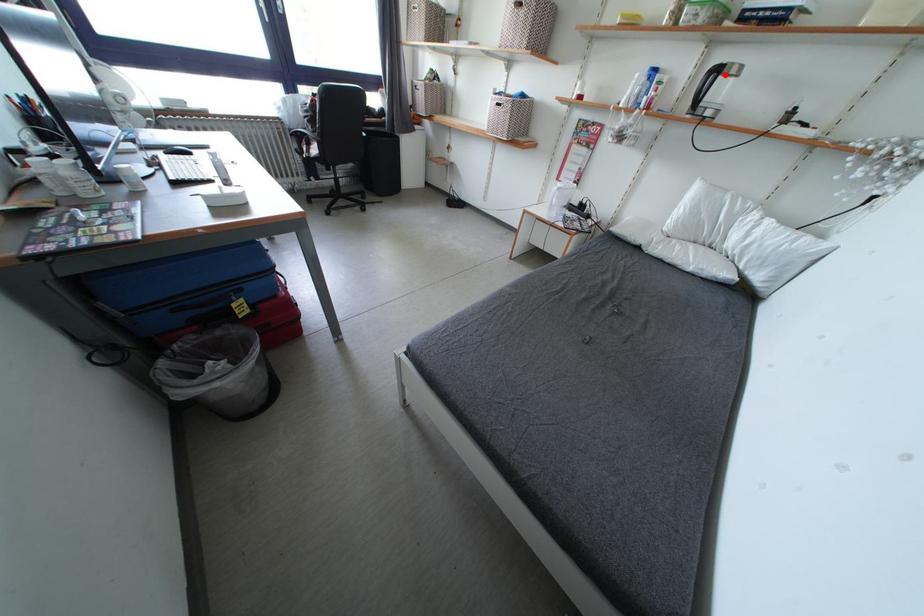
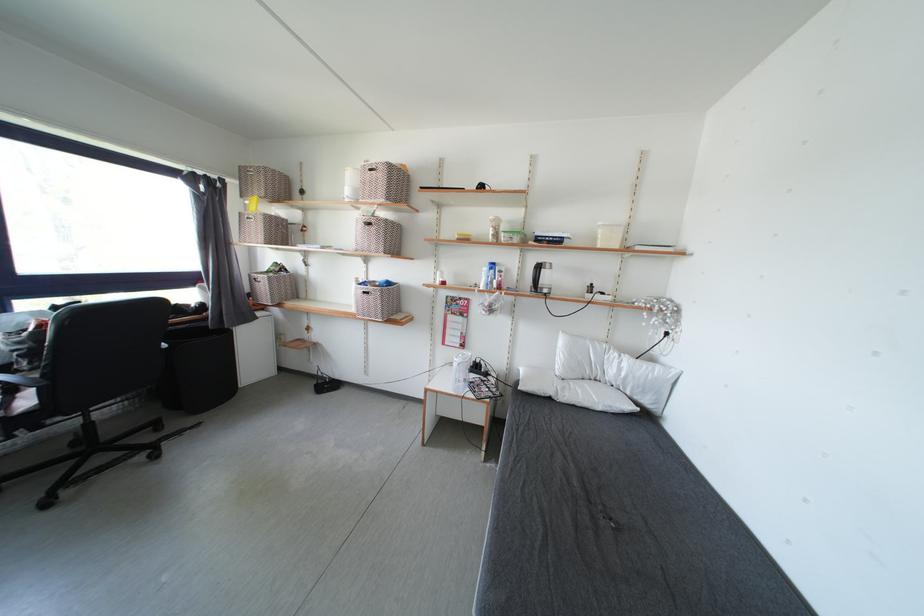
In the second image, find the point that corresponds to the highlighted location in the first image.

(545, 270)